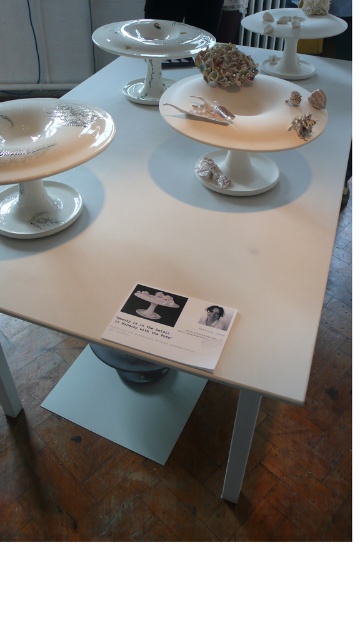
From the picture: You are an art curator standing at the edge of the table where the matte porcelain plate at upper center is displayed. If you move your hand to the right by 0.03 units from the plate, what coordinate will your hand be at?

Moving your hand to the right by 0.03 units from the matte porcelain plate at upper center located at point [151,38] would place it at coordinate [151,58].

You are an art curator arranging an exhibition. You need to ensure that the white glossy saucer at lower left and the white glossy saucer at center are placed in a way that maintains the semi circular arrangement. Given their current positions, which saucer is positioned lower on the table?

The white glossy saucer at lower left is positioned lower on the table than the white glossy saucer at center.